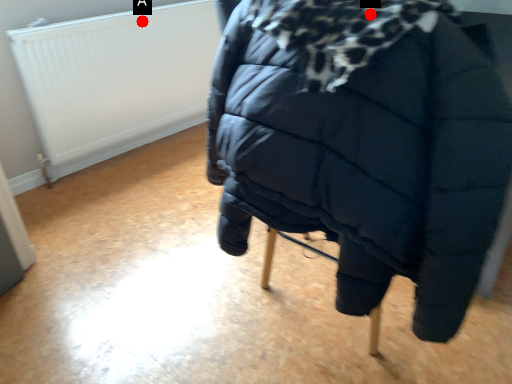
Question: Two points are circled on the image, labeled by A and B beside each circle. Among these points, which one is farthest from the camera?

Choices:
 (A) A is further
 (B) B is further

Answer: (A)